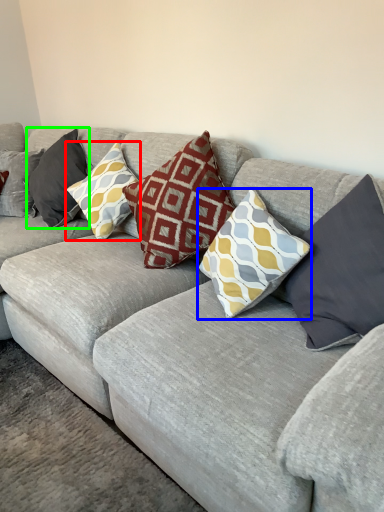
Question: Which is farther away from pillow (highlighted by a red box)? pillow (highlighted by a blue box) or pillow (highlighted by a green box)?

Choices:
 (A) pillow
 (B) pillow

Answer: (A)